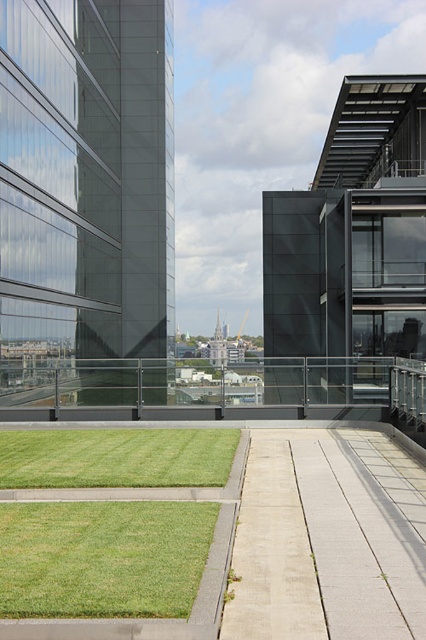
In the scene shown: Does black glass railing at center have a larger size compared to green grass at center?

Yes.

Between point (239, 412) and point (207, 442), which one is positioned behind?

The point (239, 412) is more distant.

Between point (324, 380) and point (49, 452), which one is positioned in front?

Positioned in front is point (49, 452).

This screenshot has height=640, width=426. What are the coordinates of `black glass railing at center` in the screenshot? It's located at (215, 387).

In the scene shown: Does light beige concrete pavement at center have a lesser height compared to green grass at center?

Yes.

Is light beige concrete pavement at center to the left of green grass at center from the viewer's perspective?

No, light beige concrete pavement at center is not to the left of green grass at center.

Identify the location of light beige concrete pavement at center. (328, 540).

Which is above, light beige concrete pavement at center or black glass railing at center?

Positioned higher is black glass railing at center.

This screenshot has width=426, height=640. I want to click on light beige concrete pavement at center, so click(328, 540).